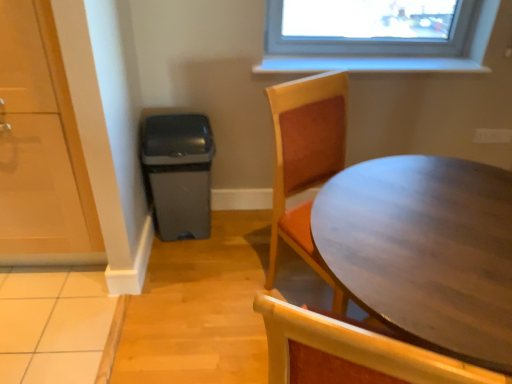
Question: Which is correct: transparent glass door at left is inside wooden table at right, or outside of it?

Choices:
 (A) outside
 (B) inside

Answer: (A)

Question: In terms of height, does transparent glass door at left look taller or shorter compared to wooden table at right?

Choices:
 (A) short
 (B) tall

Answer: (B)

Question: Considering the relative positions of transparent glass door at left and wooden table at right in the image provided, is transparent glass door at left to the left or to the right of wooden table at right?

Choices:
 (A) left
 (B) right

Answer: (A)

Question: From a real-world perspective, is wooden table at right above or below transparent glass door at left?

Choices:
 (A) above
 (B) below

Answer: (B)

Question: From the image's perspective, is wooden table at right positioned above or below transparent glass door at left?

Choices:
 (A) below
 (B) above

Answer: (A)

Question: Is point (465, 337) positioned closer to the camera than point (4, 153)?

Choices:
 (A) farther
 (B) closer

Answer: (B)

Question: Looking at their shapes, would you say wooden table at right is wider or thinner than transparent glass door at left?

Choices:
 (A) wide
 (B) thin

Answer: (A)